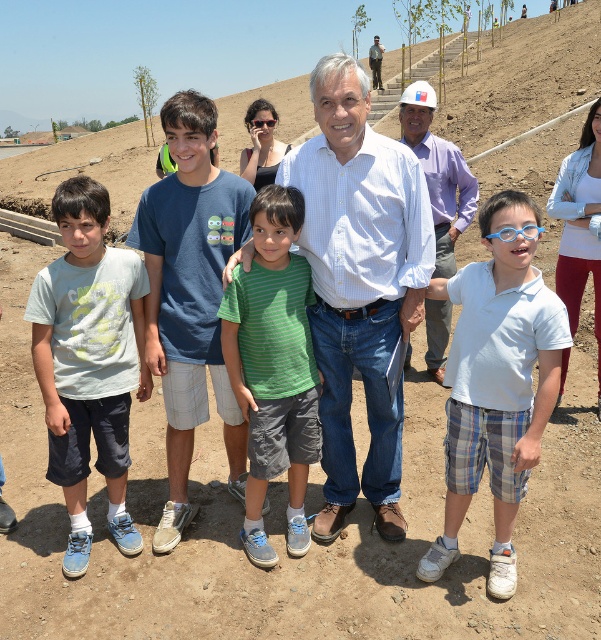
Question: Which object is positioned farthest from the green striped shirt at center?

Choices:
 (A) light gray cotton t-shirt at left
 (B) white cotton polo shirt at center

Answer: (B)

Question: Which object appears closest to the camera in this image?

Choices:
 (A) green striped shirt at center
 (B) white checkered shirt at center

Answer: (B)

Question: Is white cotton polo shirt at center wider than green striped shirt at center?

Choices:
 (A) yes
 (B) no

Answer: (A)

Question: Which object appears farthest from the camera in this image?

Choices:
 (A) white cotton polo shirt at center
 (B) green striped shirt at center

Answer: (B)

Question: Is green striped shirt at center to the left of matte white hard hat at center from the viewer's perspective?

Choices:
 (A) no
 (B) yes

Answer: (B)

Question: Does white checkered shirt at center appear on the right side of green striped shirt at center?

Choices:
 (A) yes
 (B) no

Answer: (A)